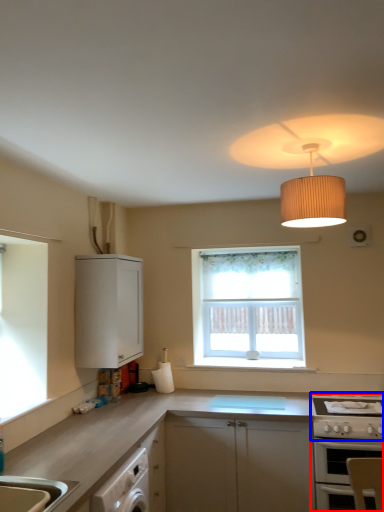
Question: Which of the following is the farthest to the observer, oven (highlighted by a red box) or gas stove (highlighted by a blue box)?

Choices:
 (A) oven
 (B) gas stove

Answer: (B)